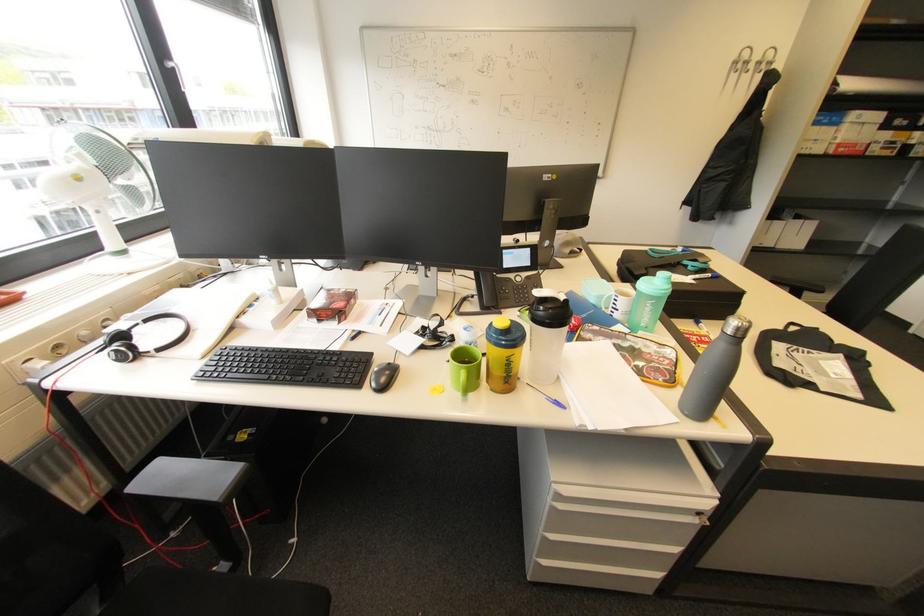
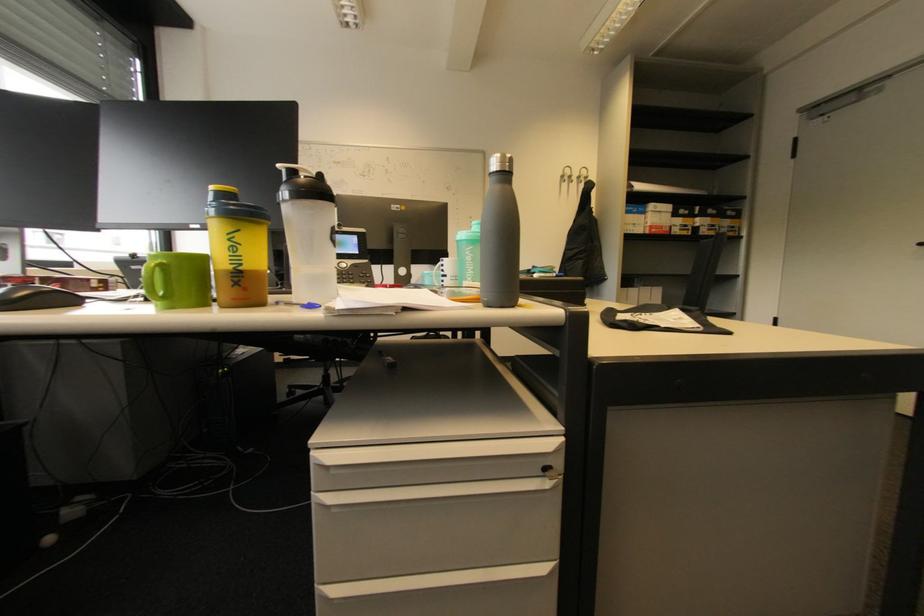
Question: I am providing you with two images of the same scene from different viewpoints. Please identify which objects are invisible in image2.

Choices:
 (A) silver bottle cap
 (B) yellow bottle cap
 (C) cabinet drawer handle
 (D) none of these

Answer: (D)